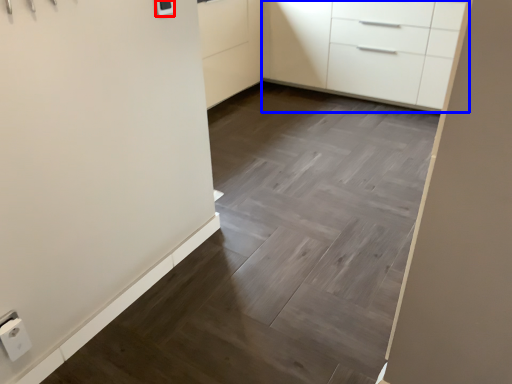
Question: Which object is closer to the camera taking this photo, light switch (highlighted by a red box) or chest of drawers (highlighted by a blue box)?

Choices:
 (A) light switch
 (B) chest of drawers

Answer: (A)